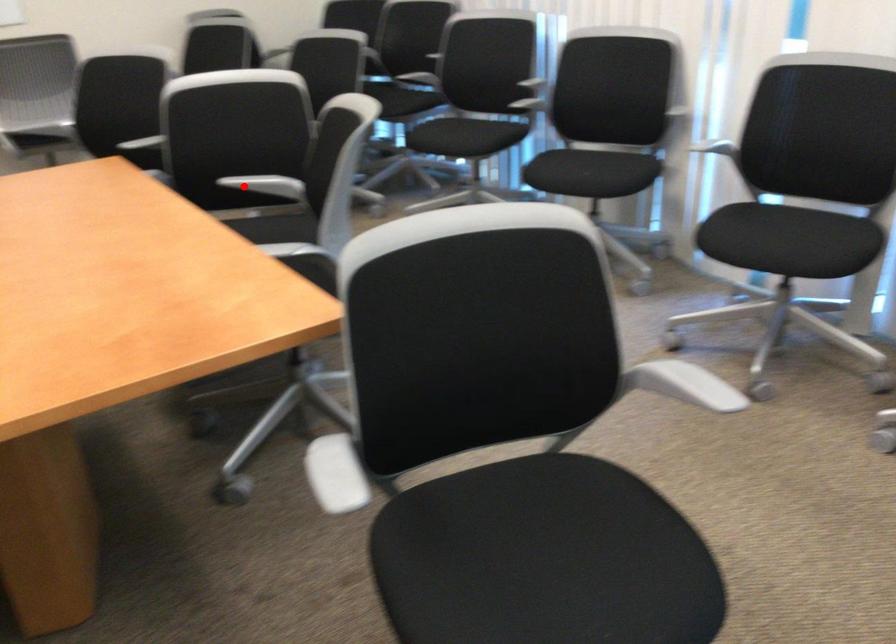
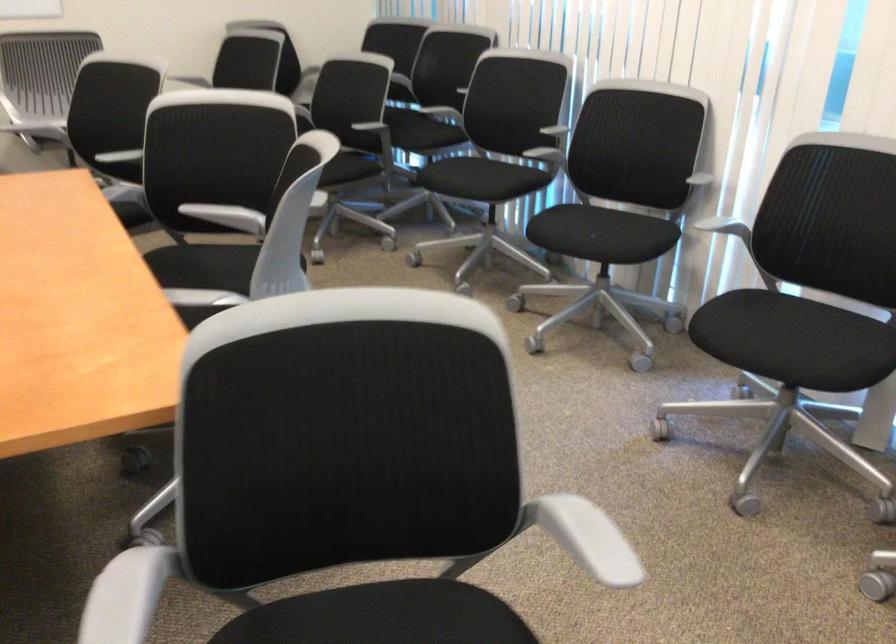
Locate, in the second image, the point that corresponds to the highlighted location in the first image.

(208, 212)